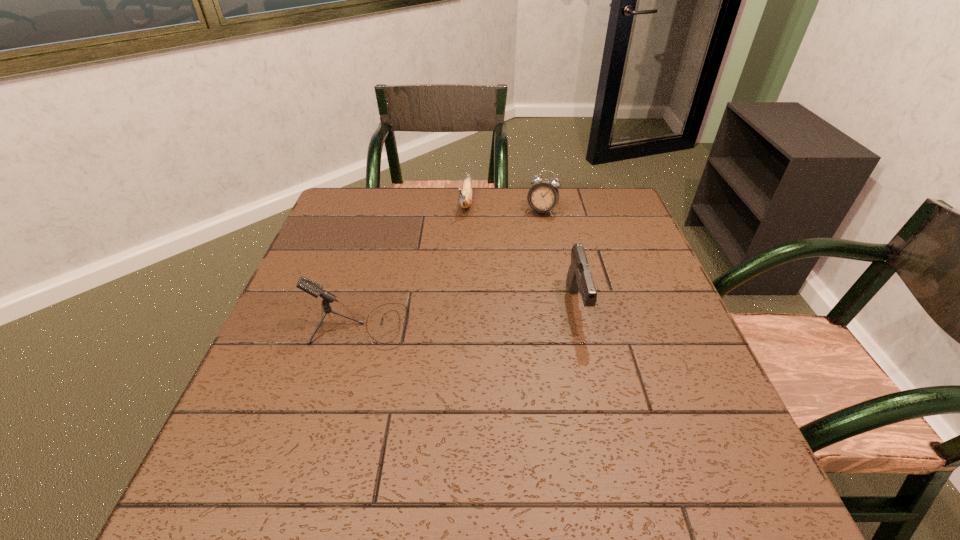
Image resolution: width=960 pixels, height=540 pixels. I want to click on free space on the desktop that is between the microphone and the pistol and is positioned on the face of the alarm clock, so click(495, 314).

Image resolution: width=960 pixels, height=540 pixels. I want to click on free spot on the desktop that is between the leftmost object and the pistol and is positioned on the peel of the third object from right to left, so click(444, 318).